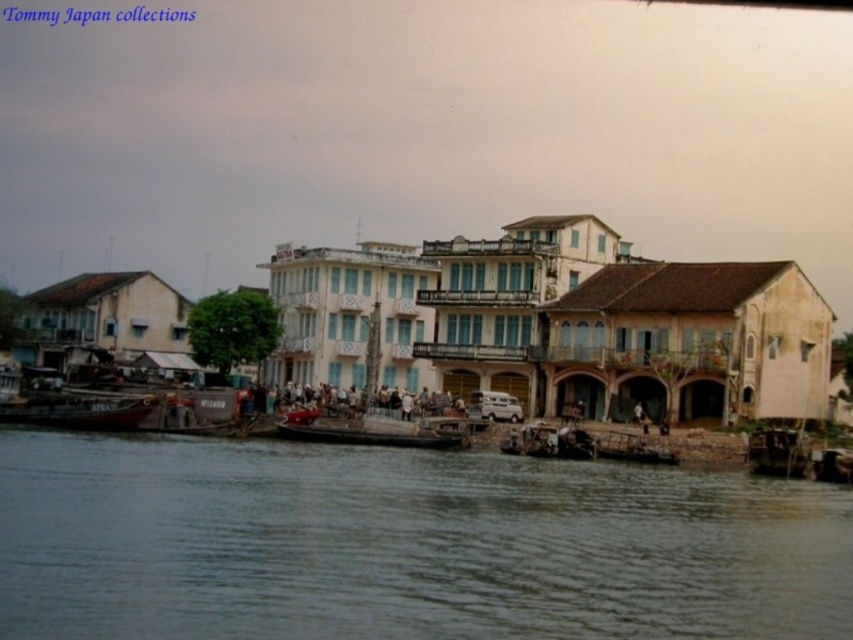
Question: In this image, where is brown water at lower center located relative to wooden boat at lower left?

Choices:
 (A) below
 (B) above

Answer: (A)

Question: Considering the real-world distances, which object is farthest from the brown water at lower center?

Choices:
 (A) wooden boat at center
 (B) wooden boat at lower left

Answer: (B)

Question: Which of these objects is positioned farthest from the brown water at lower center?

Choices:
 (A) wooden boat at lower left
 (B) wooden boat at center

Answer: (A)

Question: Which of the following is the farthest from the observer?

Choices:
 (A) wooden boat at lower left
 (B) wooden boat at center
 (C) brown water at lower center

Answer: (A)

Question: Is brown water at lower center bigger than wooden boat at lower left?

Choices:
 (A) yes
 (B) no

Answer: (A)

Question: Is wooden boat at center to the right of wooden boat at lower left from the viewer's perspective?

Choices:
 (A) yes
 (B) no

Answer: (A)